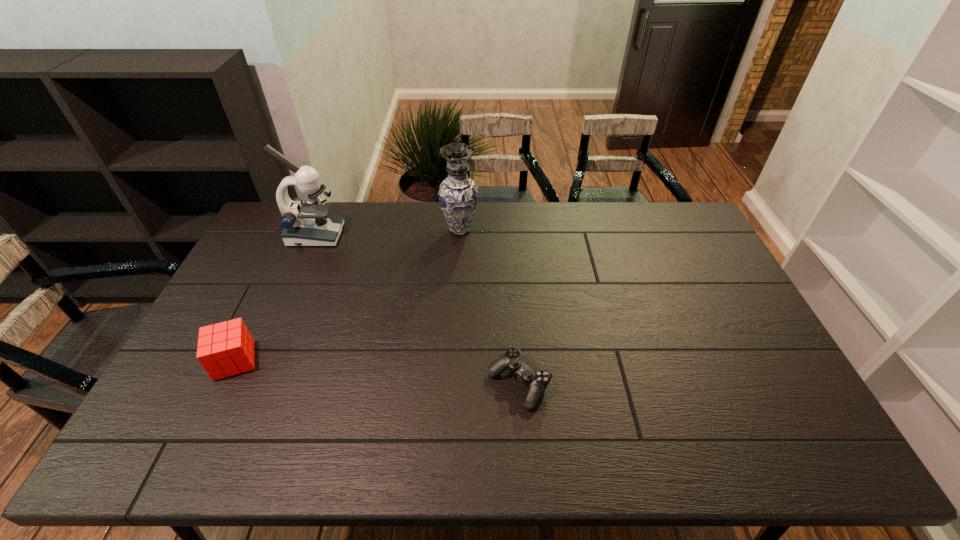
This screenshot has height=540, width=960. Find the location of `free space that satisfies the following two spatial constraints: 1. at the eyepiece of the rightmost object; 2. on the right side of the microscope`. free space that satisfies the following two spatial constraints: 1. at the eyepiece of the rightmost object; 2. on the right side of the microscope is located at coordinates (252, 383).

Identify the location of blank area in the image that satisfies the following two spatial constraints: 1. on the back side of the cube; 2. on the left side of the vase. Image resolution: width=960 pixels, height=540 pixels. (298, 230).